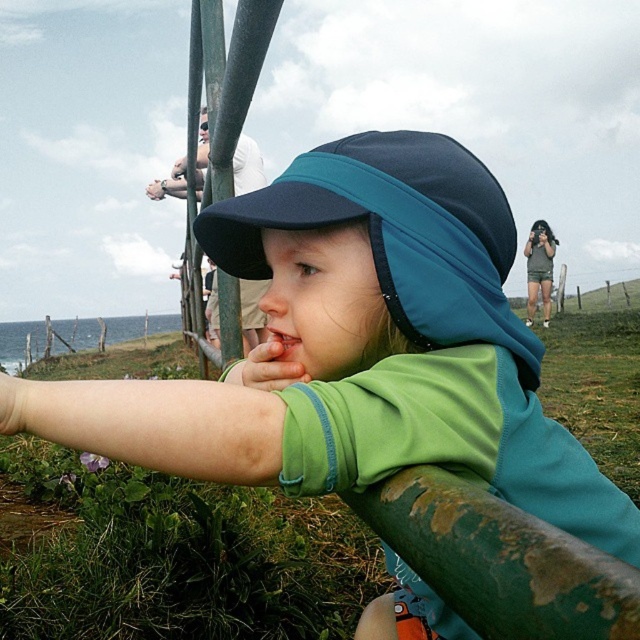
You are a fashion designer observing the child in the image. You need to determine which of the two hats, the navy blue fabric sun visor at center or the matte blue hat at upper center, is shorter in height. Which one is it?

The navy blue fabric sun visor at center has a lesser height compared to matte blue hat at upper center, so the navy blue fabric sun visor at center is shorter in height.